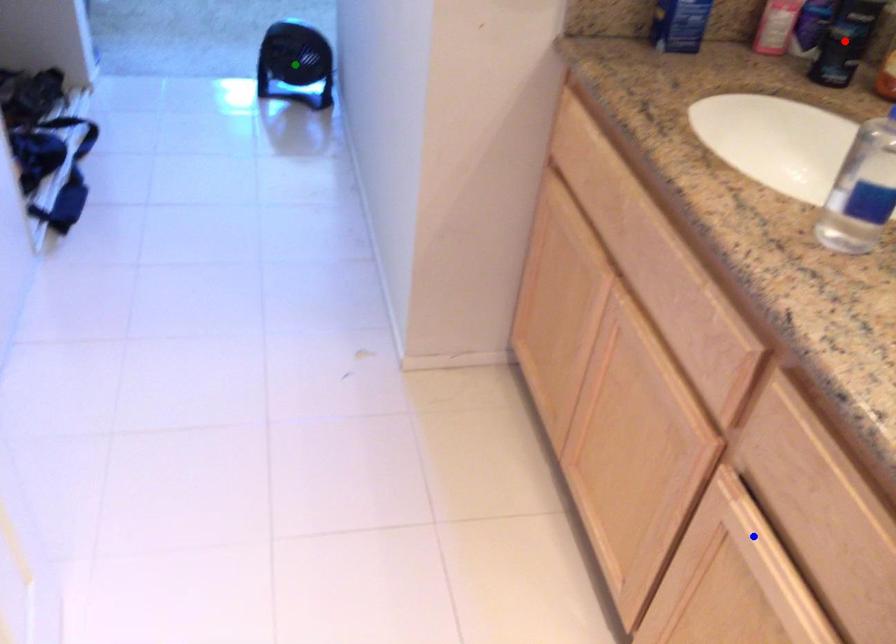
Order these from farthest to nearest:
red point
green point
blue point

1. green point
2. red point
3. blue point